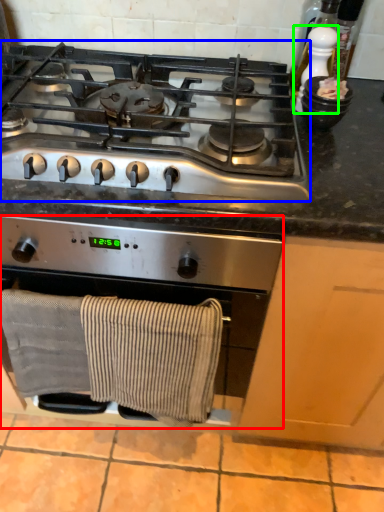
Question: Which object is the farthest from kitchen appliance (highlighted by a red box)? Choose among these: gas stove (highlighted by a blue box) or appliance (highlighted by a green box).

Choices:
 (A) gas stove
 (B) appliance

Answer: (B)